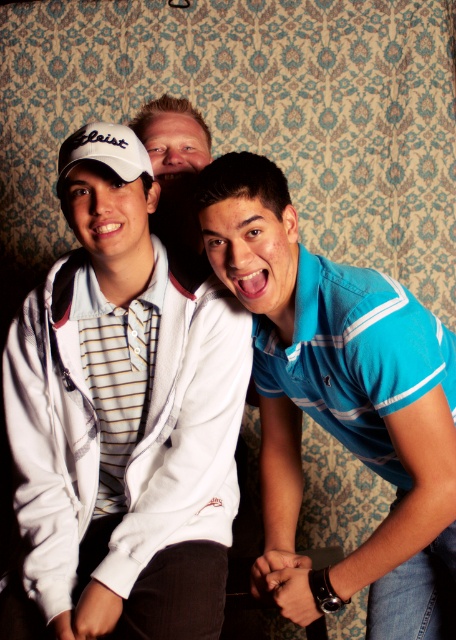
Question: Which is farther from the white matte baseball cap at upper left?

Choices:
 (A) blue cotton polo shirt at center
 (B) matte white cap at center

Answer: (A)

Question: Does white matte jacket at center have a lesser width compared to matte white cap at center?

Choices:
 (A) yes
 (B) no

Answer: (B)

Question: Which point is farther to the camera?

Choices:
 (A) white matte jacket at center
 (B) white matte baseball cap at upper left
 (C) matte white cap at center

Answer: (C)

Question: Can you confirm if blue cotton polo shirt at center is positioned to the left of white matte baseball cap at upper left?

Choices:
 (A) yes
 (B) no

Answer: (B)

Question: Which point is farther from the camera taking this photo?

Choices:
 (A) (162, 131)
 (B) (97, 140)

Answer: (A)

Question: Does blue cotton polo shirt at center appear over white matte baseball cap at upper left?

Choices:
 (A) no
 (B) yes

Answer: (A)